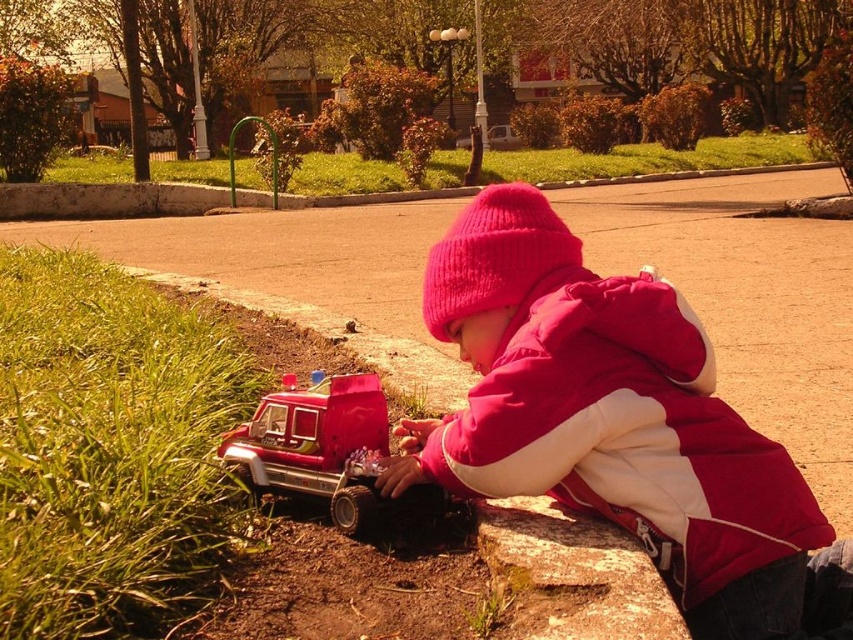
Between point (410, 502) and point (508, 134), which one is positioned in front?

Positioned in front is point (410, 502).

Can you confirm if shiny red plastic fire truck at lower left is positioned to the right of metallic silver car at center?

In fact, shiny red plastic fire truck at lower left is to the left of metallic silver car at center.

Which is in front, point (294, 444) or point (489, 148)?

Point (294, 444) is more forward.

You are a GUI agent. You are given a task and a screenshot of the screen. Output one action in this format:
    pyautogui.click(x=<x>, y=<y>)
    Task: Click on the shiny red plastic fire truck at lower left
    The image size is (853, 640).
    Given the screenshot: What is the action you would take?
    pyautogui.click(x=322, y=448)

Between pink knit hat at upper center and shiny red plastic fire truck at lower left, which one has more height?

pink knit hat at upper center

Can you confirm if pink knit hat at upper center is positioned to the left of shiny red plastic fire truck at lower left?

In fact, pink knit hat at upper center is to the right of shiny red plastic fire truck at lower left.

Which is behind, point (793, 609) or point (291, 483)?

Point (291, 483)

Find the location of a particular element. The width and height of the screenshot is (853, 640). pink knit hat at upper center is located at coordinates (616, 424).

Consider the image. Is pink knit hat at upper center smaller than metallic silver car at center?

Yes.

At what (x,y) coordinates should I click in order to perform the action: click on pink knit hat at upper center. Please return your answer as a coordinate pair (x, y). Looking at the image, I should click on (616, 424).